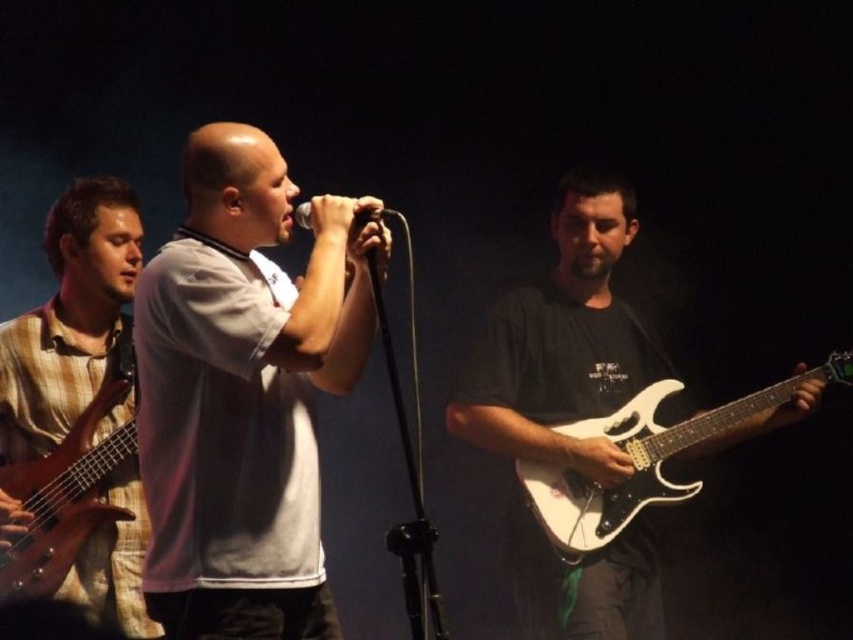
You are a stagehand who needs to move both guitars from the stage. The white glossy guitar at right is heavier than the plaid fabric guitar at left. Which guitar should you pick up first if you want to carry both at once?

The plaid fabric guitar at left is lighter and smaller, so you should pick it up first to carry both guitars at once.

You are a photographer in a dark concert venue. You need to capture a closeup of the metallic silver microphone at center while ensuring the plaid fabric guitar at left is still visible in the frame. Given their sizes, will you need to adjust your camera angle to include both?

The plaid fabric guitar at left is wider than the metallic silver microphone at center, so you will need to adjust your camera angle to ensure both are visible in the frame.

You are standing at the point marked as point (538, 413). The lead singer is 3.13 meters away from you. Which direction should you move to get closer to the lead singer?

Since the lead singer is 3.13 meters away from point (538, 413), you should move towards the lead singer to reduce the distance between you and them.